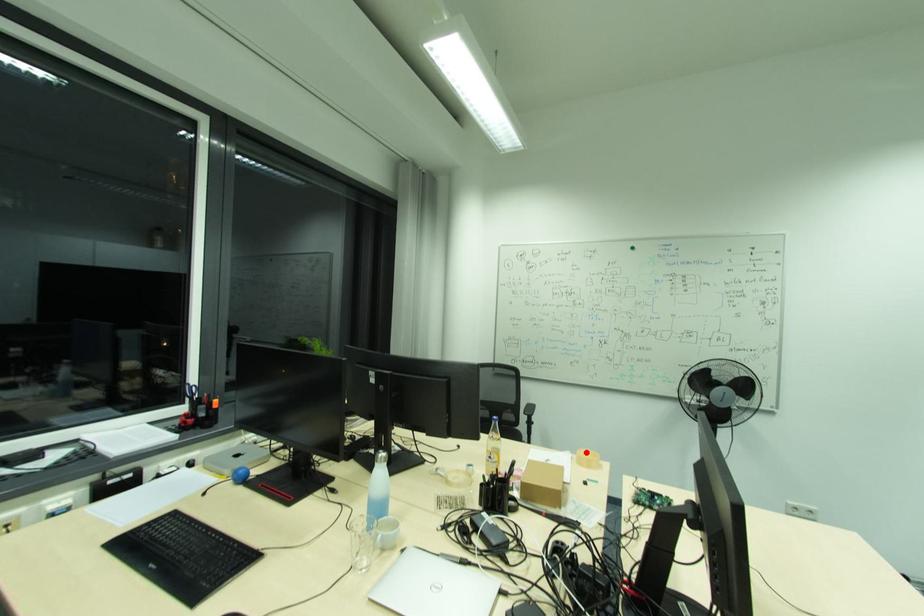
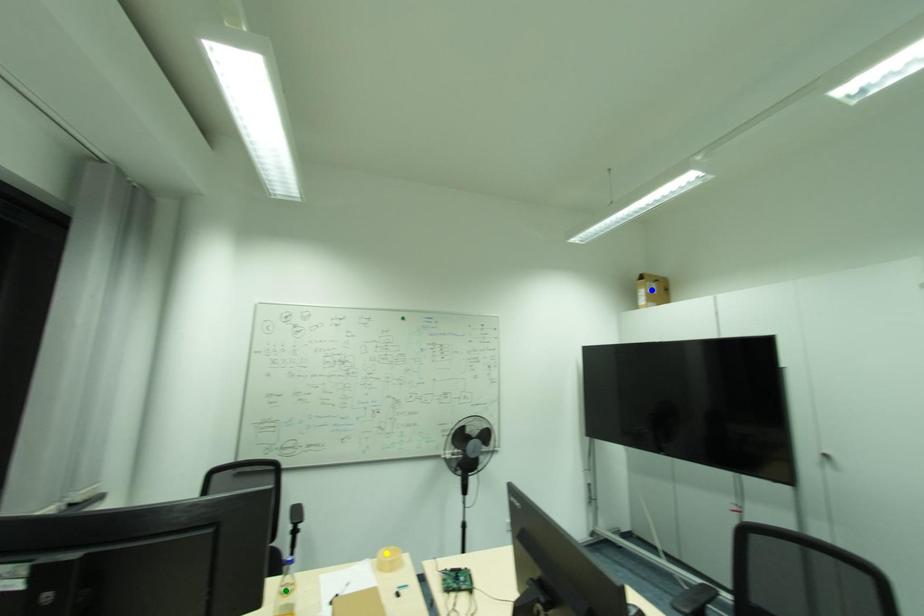
Question: I am providing you with two images of the same scene from different viewpoints. A red point is marked on the first image. You are given multiple points on the second image. In image 2, which mark is for the same physical point as the one in image 1?

Choices:
 (A) blue point
 (B) yellow point
 (C) green point

Answer: (B)